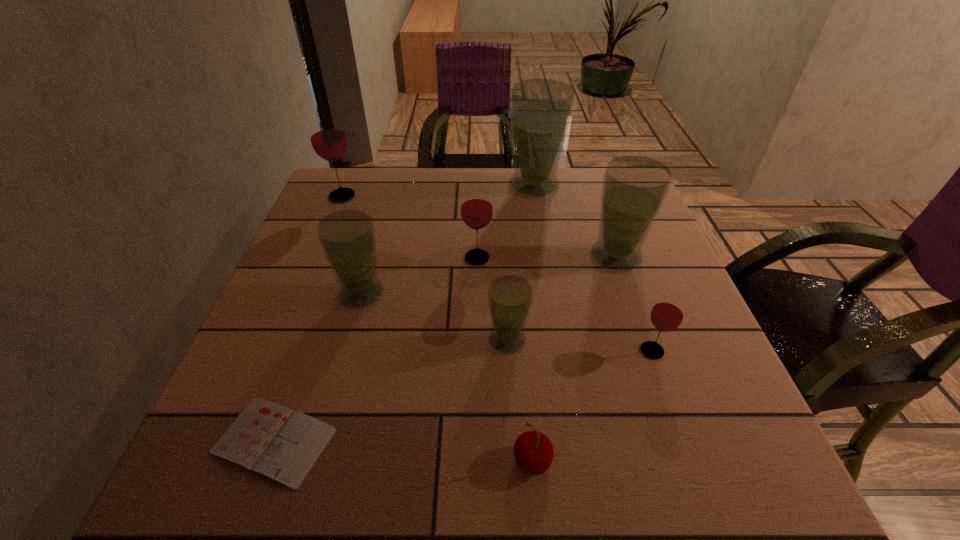
Where is `the rightmost red glass`? The height and width of the screenshot is (540, 960). the rightmost red glass is located at coordinates (667, 314).

This screenshot has width=960, height=540. Identify the location of the nearest red glass. (667, 314).

Locate an element on the screen. the nearest blue glass is located at coordinates point(510,297).

This screenshot has height=540, width=960. I want to click on cherry, so click(x=533, y=451).

Identify the location of red cherry. The image size is (960, 540). (533, 451).

This screenshot has height=540, width=960. Find the location of `diary`. diary is located at coordinates (273, 440).

Find the location of a particular element. The image size is (960, 540). blank area located 0.290m on the left of the farthest blue glass is located at coordinates (404, 185).

What are the coordinates of `vacant space located 0.230m on the front of the leftmost red glass` in the screenshot? It's located at (315, 261).

Locate an element on the screen. This screenshot has height=540, width=960. free spot located 0.090m on the left of the second farthest blue glass is located at coordinates (549, 256).

Identify the location of vacant space located on the right of the second farthest red glass. (518, 258).